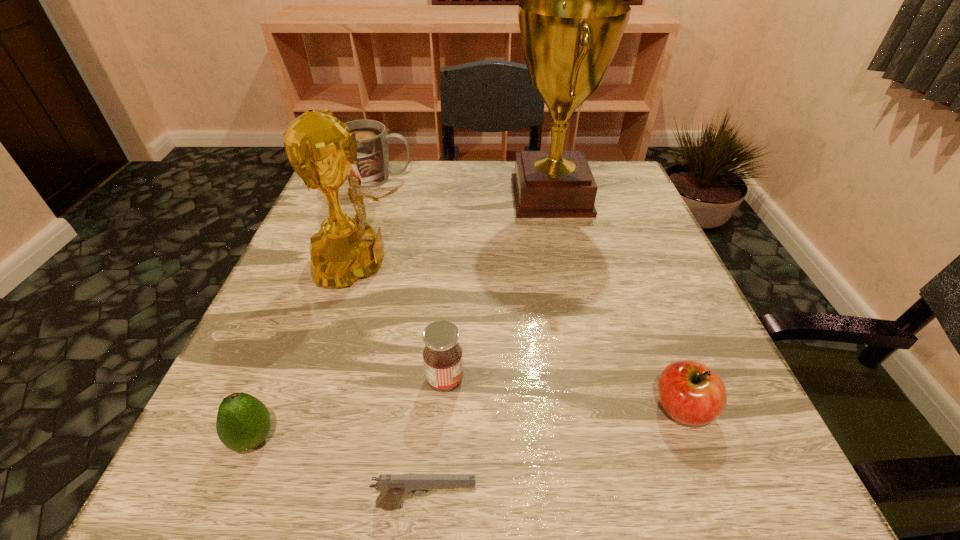
Locate an element on the screen. The image size is (960, 540). vacant region located 0.260m on the plaque of the right award is located at coordinates (405, 197).

At what (x,y) coordinates should I click in order to perform the action: click on free spot located on the plaque of the right award. Please return your answer as a coordinate pair (x, y). Looking at the image, I should click on [x=413, y=197].

Where is `blank space located 0.100m on the front side of the left award`? The image size is (960, 540). blank space located 0.100m on the front side of the left award is located at coordinates (462, 264).

Where is `vacant space located on the side of the fifth shortest object with the handle`? vacant space located on the side of the fifth shortest object with the handle is located at coordinates (447, 178).

In order to click on vacant space situated on the label side of the jam in this screenshot , I will do `click(520, 379)`.

Where is `blank space located 0.130m on the right of the avocado`? blank space located 0.130m on the right of the avocado is located at coordinates (369, 438).

Where is `vacant region located 0.070m on the back of the apple`? The image size is (960, 540). vacant region located 0.070m on the back of the apple is located at coordinates (660, 348).

Where is `free space located at the barrel of the pistol`? The width and height of the screenshot is (960, 540). free space located at the barrel of the pistol is located at coordinates (523, 505).

You are a GUI agent. You are given a task and a screenshot of the screen. Output one action in this format:
    pyautogui.click(x=<x>, y=<y>)
    Task: Click on the award positioned at the far edge
    The height and width of the screenshot is (540, 960).
    Given the screenshot: What is the action you would take?
    pyautogui.click(x=571, y=23)

You are a GUI agent. You are given a task and a screenshot of the screen. Output one action in this format:
    pyautogui.click(x=<x>, y=<y>)
    Task: Click on the mug present at the far edge
    The width and height of the screenshot is (960, 540).
    Given the screenshot: What is the action you would take?
    pyautogui.click(x=372, y=169)